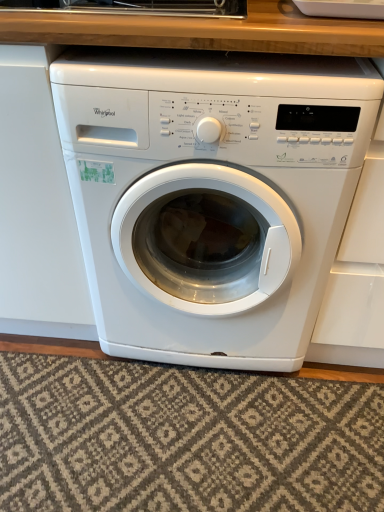
Where is `vacant region below textured beige rug at lower center (from a real-world perspective)`? The height and width of the screenshot is (512, 384). vacant region below textured beige rug at lower center (from a real-world perspective) is located at coordinates (196, 446).